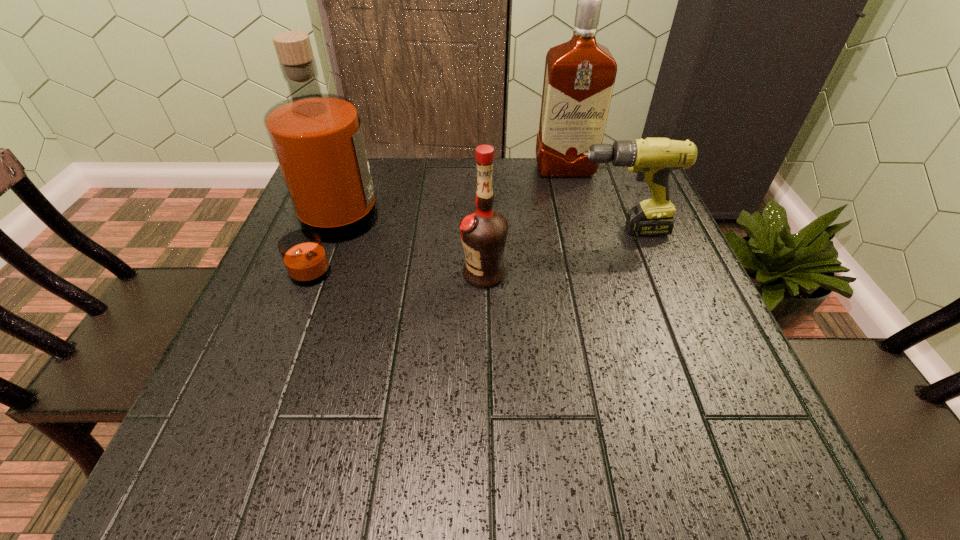
In the image, there is a desktop. Where is `vacant area at the near edge`? The image size is (960, 540). vacant area at the near edge is located at coordinates (544, 426).

Locate an element on the screen. This screenshot has height=540, width=960. vacant space at the left edge is located at coordinates (297, 290).

You are a GUI agent. You are given a task and a screenshot of the screen. Output one action in this format:
    pyautogui.click(x=<x>, y=<y>)
    Task: Click on the free space at the right edge of the desktop
    The width and height of the screenshot is (960, 540).
    Given the screenshot: What is the action you would take?
    pyautogui.click(x=737, y=396)

At what (x,y) coordinates should I click in order to perform the action: click on vacant area at the near left corner of the desktop. Please return your answer as a coordinate pair (x, y). This screenshot has width=960, height=540. Looking at the image, I should click on (241, 426).

This screenshot has height=540, width=960. What are the coordinates of `free region at the far right corner of the desktop` in the screenshot? It's located at (619, 192).

Where is `unoccupied area between the farthest liquor and the leftmost liquor`? unoccupied area between the farthest liquor and the leftmost liquor is located at coordinates (449, 204).

The height and width of the screenshot is (540, 960). In order to click on empty location between the farthest liquor and the shortest object in this screenshot , I will do `click(591, 200)`.

You are a GUI agent. You are given a task and a screenshot of the screen. Output one action in this format:
    pyautogui.click(x=<x>, y=<y>)
    Task: Click on the empty location between the rightmost liquor and the shortest liquor
    Image resolution: width=960 pixels, height=540 pixels.
    Given the screenshot: What is the action you would take?
    pyautogui.click(x=524, y=221)

Locate an element on the screen. The width and height of the screenshot is (960, 540). vacant point located between the second liquor from right to left and the shortest object is located at coordinates (551, 252).

At what (x,y) coordinates should I click in order to perform the action: click on empty location between the rightmost liquor and the shortest liquor. Please return your answer as a coordinate pair (x, y). Looking at the image, I should click on (524, 221).